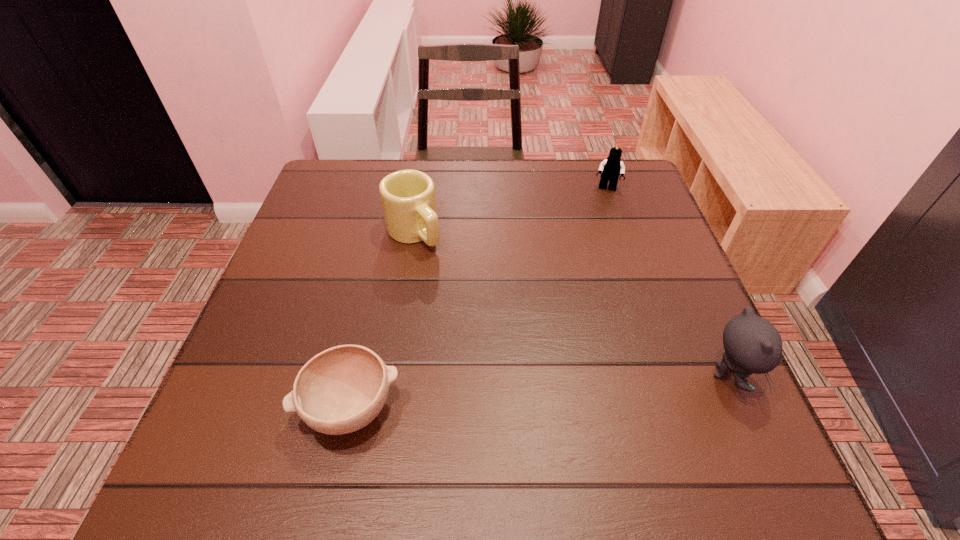
The image size is (960, 540). In order to click on empty space that is in between the third nearest object and the bowl in this screenshot , I will do `click(382, 320)`.

Where is `vacant area that lies between the second farthest object and the shortest object`? vacant area that lies between the second farthest object and the shortest object is located at coordinates (382, 320).

Find the location of a particular element. This screenshot has width=960, height=540. free point between the mug and the bowl is located at coordinates (382, 320).

You are a GUI agent. You are given a task and a screenshot of the screen. Output one action in this format:
    pyautogui.click(x=<x>, y=<y>)
    Task: Click on the free spot between the Lego and the second farthest object
    The image size is (960, 540).
    Given the screenshot: What is the action you would take?
    pyautogui.click(x=510, y=211)

This screenshot has height=540, width=960. I want to click on free space between the second object from right to left and the bowl, so click(x=478, y=299).

Where is `vacant area that lies between the Lego and the rightmost object`? The width and height of the screenshot is (960, 540). vacant area that lies between the Lego and the rightmost object is located at coordinates (667, 282).

This screenshot has width=960, height=540. In order to click on free space between the rightmost object and the third object from left to right in this screenshot , I will do `click(667, 282)`.

The width and height of the screenshot is (960, 540). I want to click on free space between the kitten and the third nearest object, so pos(571,303).

Locate an element on the screen. object identified as the second closest to the second farthest object is located at coordinates (611, 168).

This screenshot has width=960, height=540. Find the location of `object that is the closest to the kitten`. object that is the closest to the kitten is located at coordinates (611, 168).